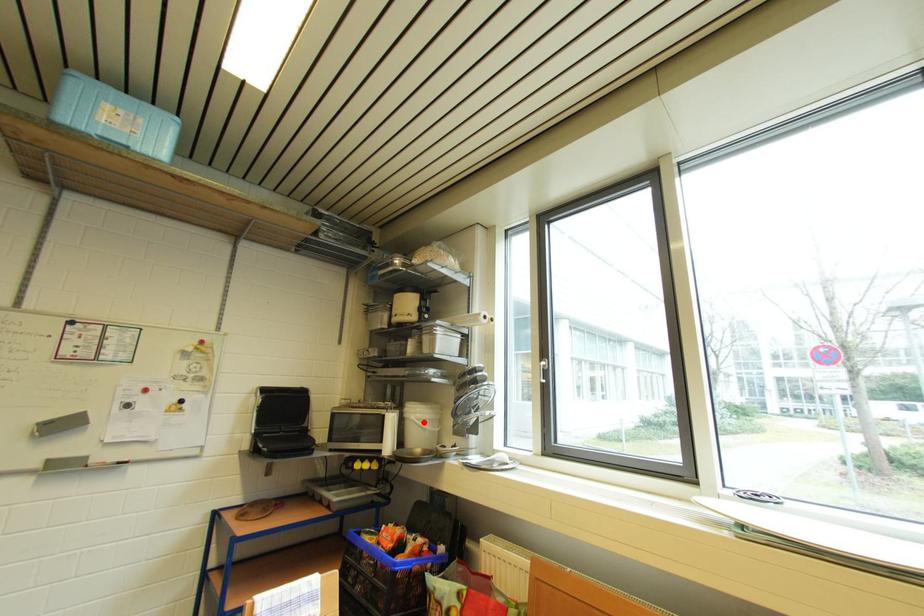
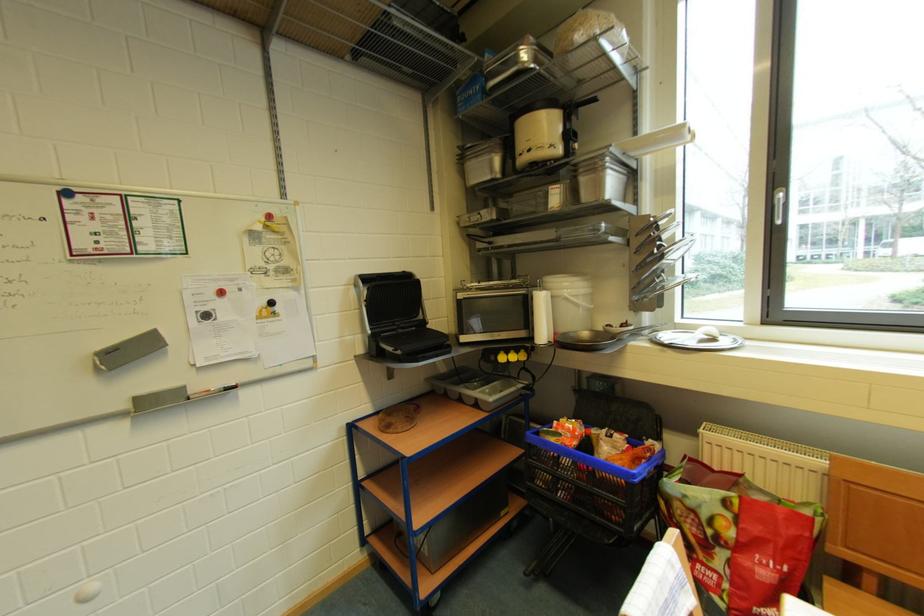
Find the pixel in the second image that matches the highlighted location in the first image.

(578, 299)